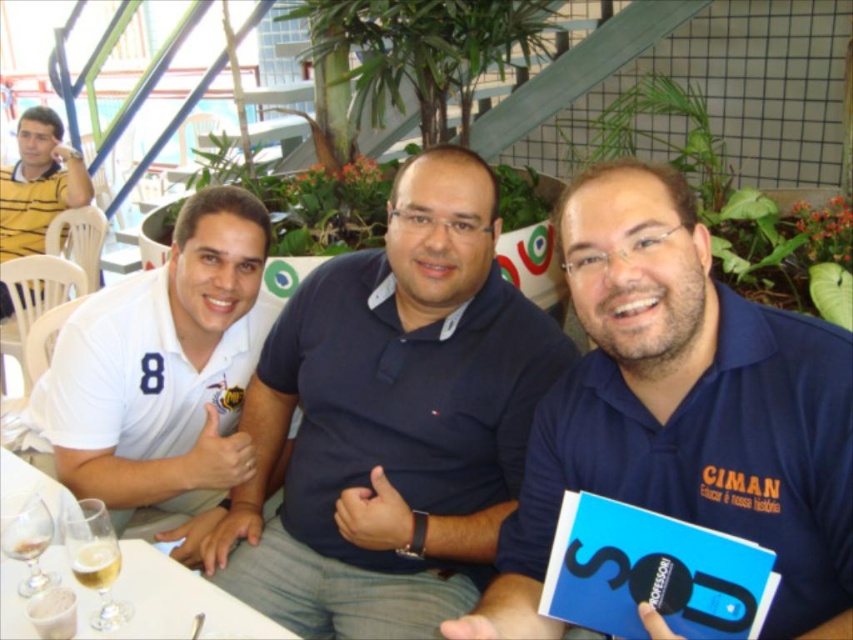
You are a photographer trying to capture a clear shot of both the white matte polo shirt at left and the yellow striped shirt at upper left. Which one will appear larger in your photo?

The white matte polo shirt at left will appear larger in the photo because it is closer to the viewer than the yellow striped shirt at upper left.

In the scene shown: You are standing at the point labeled point (10, 193) and want to walk to the point labeled point (782, 580). Which direction should you move in relative to the scene?

You should move forward towards the point labeled point (782, 580) because it is in front of the point labeled point (10, 193).

You are a photographer trying to capture a candid shot of the yellow striped shirt at upper left without including the white glossy table at lower left in the frame. Based on their positions, is this possible?

The white glossy table at lower left is in front of the yellow striped shirt at upper left, so it would block the view. Therefore, capturing the yellow striped shirt at upper left without the white glossy table at lower left in the frame is not possible.